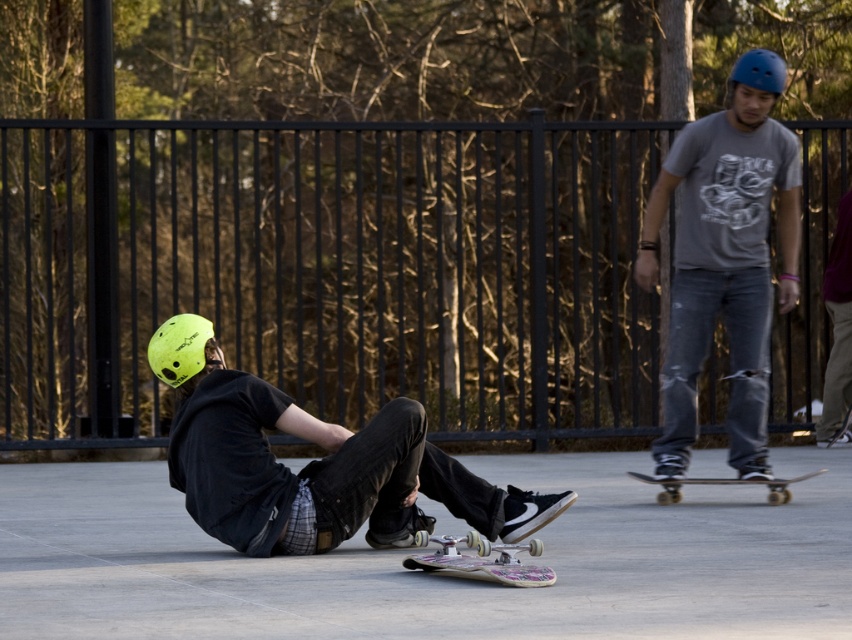
Does matte gray t-shirt at center appear over floral-patterned wood skateboard at lower center?

Yes.

Who is higher up, matte gray t-shirt at center or floral-patterned wood skateboard at lower center?

Positioned higher is matte gray t-shirt at center.

Is point (763, 273) less distant than point (532, 544)?

No, (763, 273) is further to viewer.

Where is `matte gray t-shirt at center`? matte gray t-shirt at center is located at coordinates (724, 259).

Does neon yellow helmet at lower left appear on the right side of wooden skateboard at center?

Incorrect, neon yellow helmet at lower left is not on the right side of wooden skateboard at center.

Who is more forward, (309, 490) or (778, 493)?

Point (309, 490)

Locate an element on the screen. neon yellow helmet at lower left is located at coordinates (314, 464).

Between floral-patterned wood skateboard at lower center and wooden skateboard at center, which one appears on the right side from the viewer's perspective?

Positioned to the right is wooden skateboard at center.

Does floral-patterned wood skateboard at lower center appear on the left side of wooden skateboard at center?

Indeed, floral-patterned wood skateboard at lower center is positioned on the left side of wooden skateboard at center.

Image resolution: width=852 pixels, height=640 pixels. Find the location of `floral-patterned wood skateboard at lower center`. floral-patterned wood skateboard at lower center is located at coordinates (481, 557).